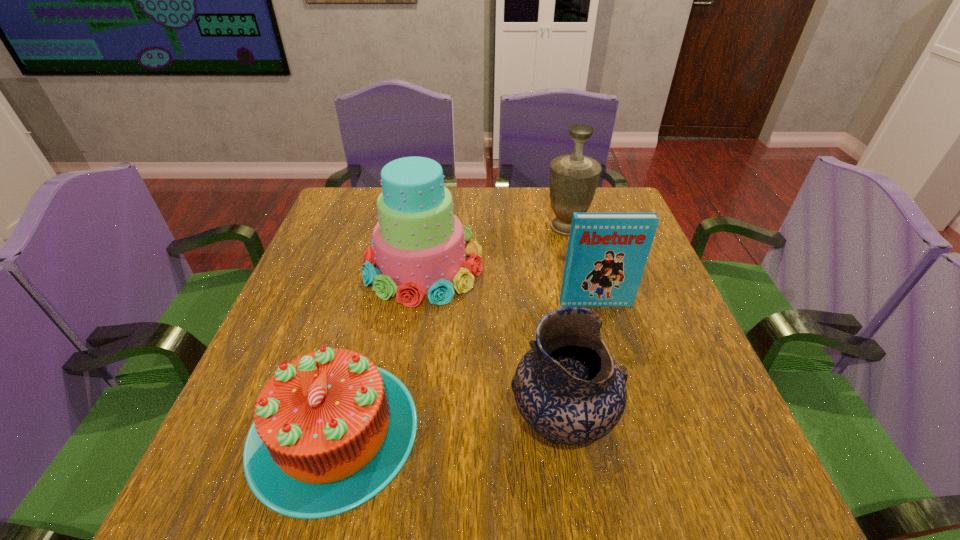
The width and height of the screenshot is (960, 540). Find the location of `blank region between the farther cake and the shorter cake`. blank region between the farther cake and the shorter cake is located at coordinates (378, 347).

Find the location of a particular element. This screenshot has width=960, height=540. blank region between the book and the farther cake is located at coordinates (510, 284).

At what (x,y) coordinates should I click in order to perform the action: click on vacant area between the taller cake and the urn. Please return your answer as a coordinate pair (x, y). This screenshot has width=960, height=540. Looking at the image, I should click on (495, 246).

The height and width of the screenshot is (540, 960). I want to click on vacant area that lies between the shorter cake and the pottery, so click(447, 426).

Where is `vacant point located between the shorter cake and the pottery`? The height and width of the screenshot is (540, 960). vacant point located between the shorter cake and the pottery is located at coordinates (447, 426).

The width and height of the screenshot is (960, 540). Find the location of `vacant area between the farther cake and the pottery`. vacant area between the farther cake and the pottery is located at coordinates coord(492,343).

Identify the location of the closest object to the book. (418, 246).

The width and height of the screenshot is (960, 540). Identify the location of the third closest object to the urn. [568, 388].

Locate an element on the screen. This screenshot has width=960, height=540. free spot that satisfies the following two spatial constraints: 1. on the back side of the farther cake; 2. on the left side of the urn is located at coordinates (429, 228).